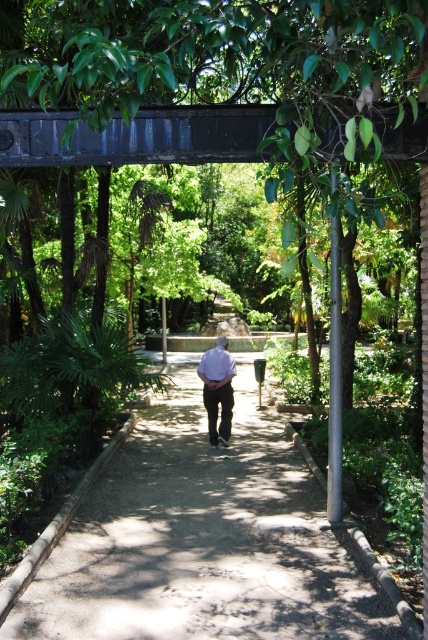
Between brown concrete pavement at center and light purple shirt at center, which one is positioned lower?

brown concrete pavement at center

Can you confirm if brown concrete pavement at center is smaller than light purple shirt at center?

Actually, brown concrete pavement at center might be larger than light purple shirt at center.

The width and height of the screenshot is (428, 640). I want to click on brown concrete pavement at center, so click(202, 541).